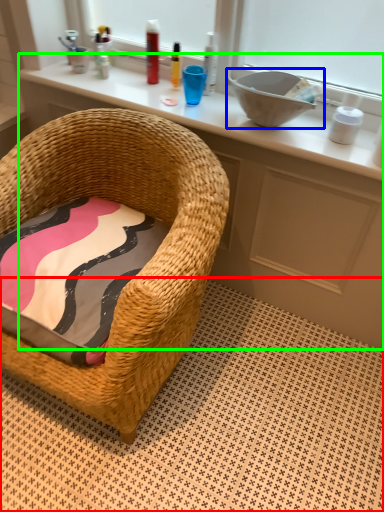
Question: Which is farther away from tile (highlighted by a red box)? sink (highlighted by a blue box) or vanity (highlighted by a green box)?

Choices:
 (A) sink
 (B) vanity

Answer: (A)